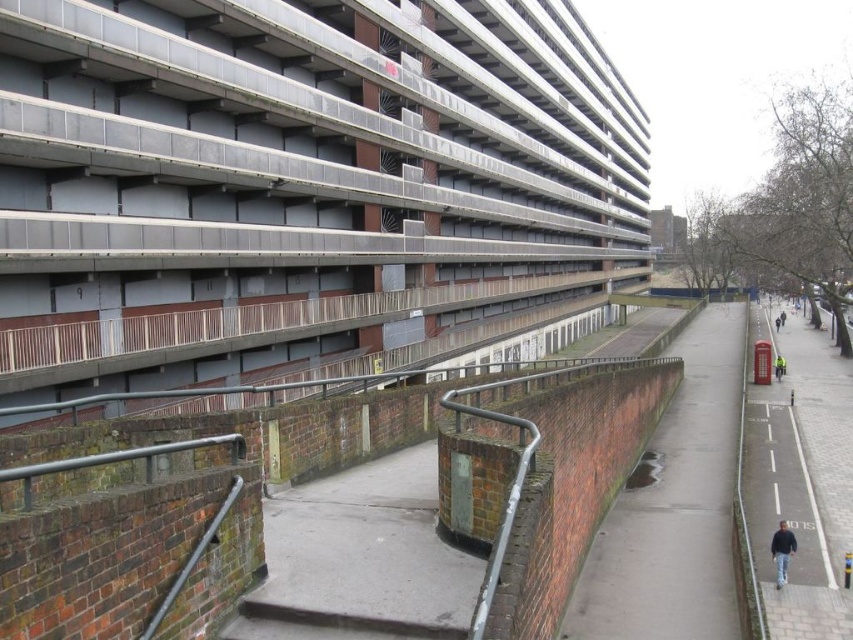
In order to click on smooth concrete pavement at center in this screenshot , I will do `click(675, 506)`.

Consider the image. Between smooth concrete pavement at center and yellow reflective jacket at right, which one appears on the right side from the viewer's perspective?

yellow reflective jacket at right is more to the right.

You are a GUI agent. You are given a task and a screenshot of the screen. Output one action in this format:
    pyautogui.click(x=<x>, y=<y>)
    Task: Click on the smooth concrete pavement at center
    Image resolution: width=853 pixels, height=640 pixels.
    Given the screenshot: What is the action you would take?
    pyautogui.click(x=675, y=506)

At what (x,y) coordinates should I click in order to perform the action: click on smooth concrete pavement at center. Please return your answer as a coordinate pair (x, y). The height and width of the screenshot is (640, 853). Looking at the image, I should click on (675, 506).

Can you confirm if smooth concrete pavement at center is positioned below smooth asphalt road at right?

Yes, smooth concrete pavement at center is below smooth asphalt road at right.

Does smooth concrete pavement at center have a larger size compared to smooth asphalt road at right?

No.

Where is `smooth concrete pavement at center`? smooth concrete pavement at center is located at coordinates (675, 506).

Does smooth asphalt road at right have a lesser width compared to concrete at lower center?

Incorrect, smooth asphalt road at right's width is not less than concrete at lower center's.

Is smooth asphalt road at right taller than concrete at lower center?

Yes.

This screenshot has height=640, width=853. What do you see at coordinates (799, 481) in the screenshot?
I see `smooth asphalt road at right` at bounding box center [799, 481].

Locate an element on the screen. smooth asphalt road at right is located at coordinates coord(799,481).